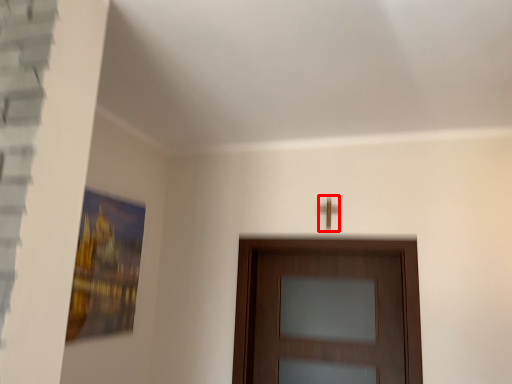
Question: From the image's perspective, what is the correct spatial positioning of door handle (annotated by the red box) in reference to door?

Choices:
 (A) below
 (B) above

Answer: (B)